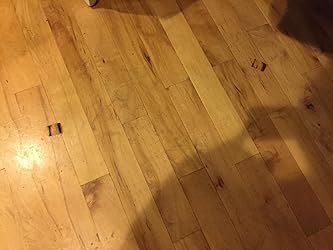
At what (x,y) coordinates should I click in order to perform the action: click on marks on the floor. Please return your answer as a coordinate pair (x, y). Looking at the image, I should click on (57, 131), (255, 66).